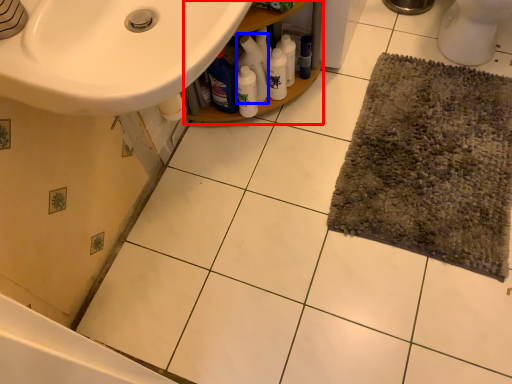
Question: Which object is closer to the camera taking this photo, balustrade (highlighted by a red box) or cleaning product (highlighted by a blue box)?

Choices:
 (A) balustrade
 (B) cleaning product

Answer: (A)